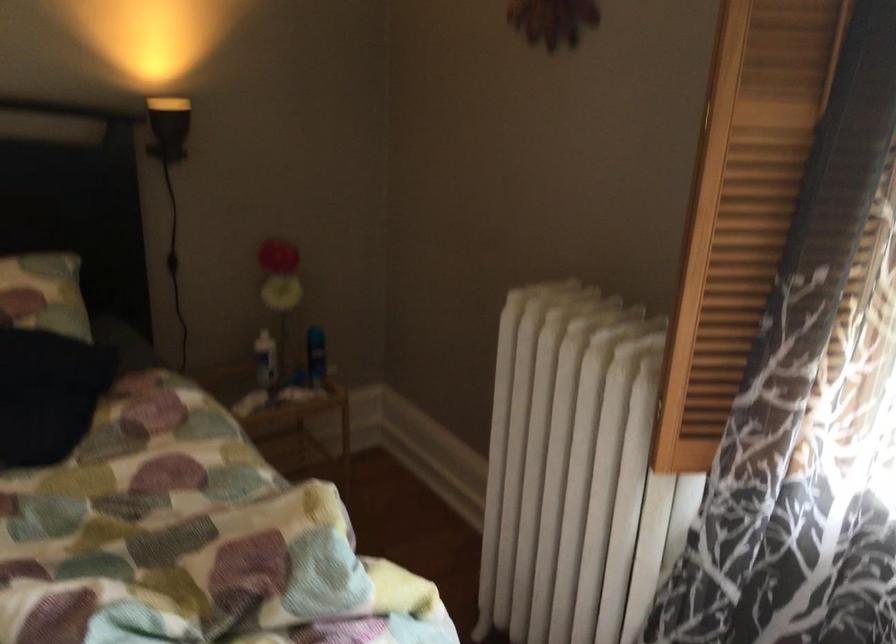
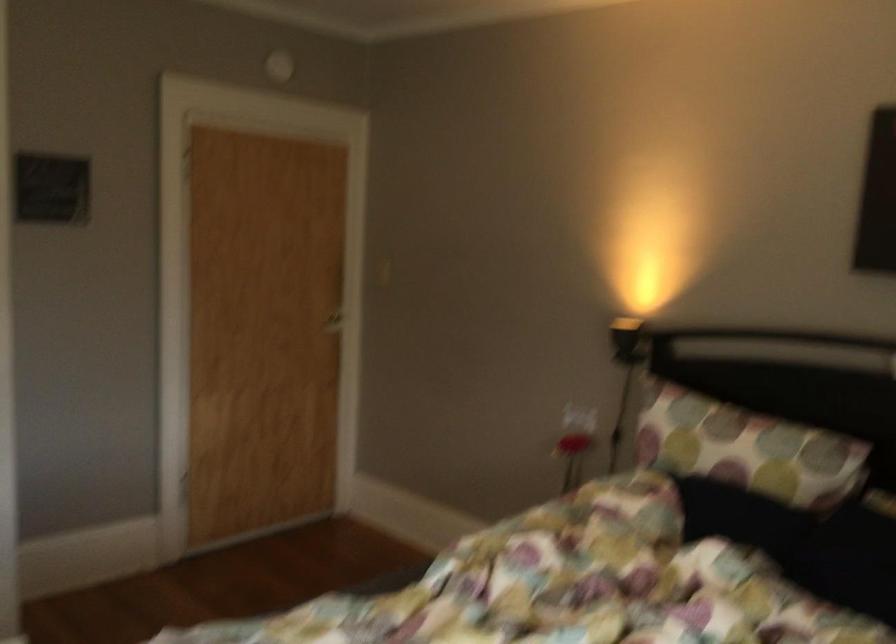
Question: Based on the continuous images, in which direction is the camera rotating? Reply with the corresponding letter.

Choices:
 (A) Left
 (B) Right
 (C) Up
 (D) Down

Answer: (A)